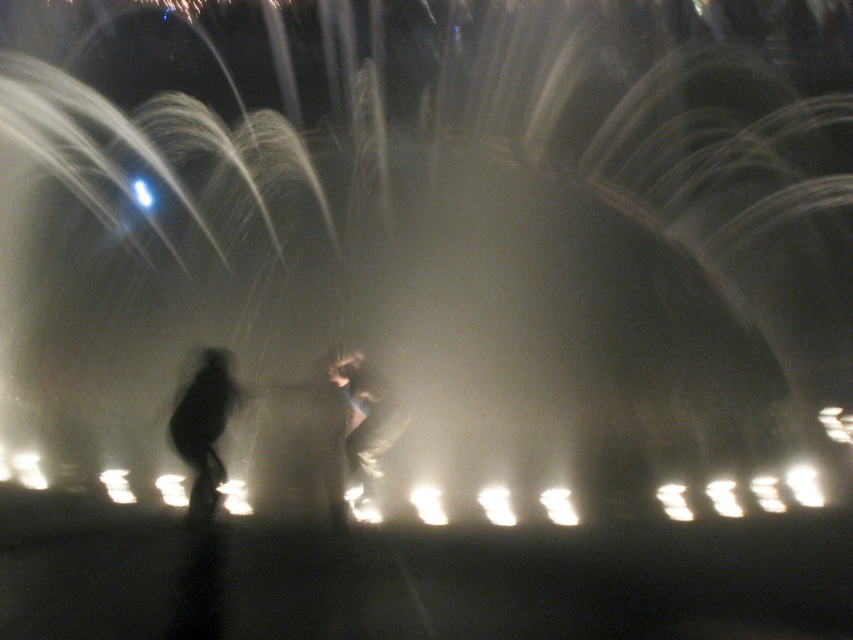
Question: Can you confirm if silhouette figure at center is positioned to the left of black matte figure at left?

Choices:
 (A) yes
 (B) no

Answer: (B)

Question: Which point is closer to the camera?

Choices:
 (A) (189, 500)
 (B) (347, 372)

Answer: (A)

Question: Is silhouette figure at center behind black matte figure at left?

Choices:
 (A) no
 (B) yes

Answer: (B)

Question: Which point is closer to the camera?

Choices:
 (A) (206, 388)
 (B) (344, 388)

Answer: (A)

Question: Does silhouette figure at center have a larger size compared to black matte figure at left?

Choices:
 (A) no
 (B) yes

Answer: (B)